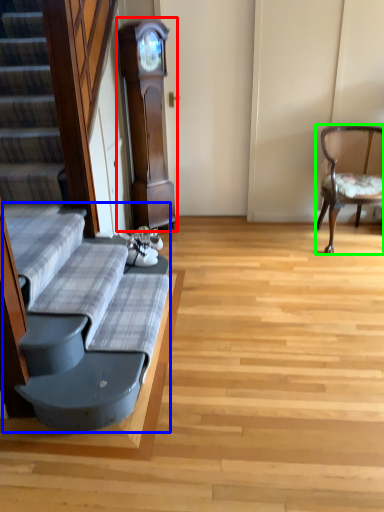
Question: Considering the real-world distances, which object is farthest from cabinetry (highlighted by a red box)? couch (highlighted by a blue box) or chair (highlighted by a green box)?

Choices:
 (A) couch
 (B) chair

Answer: (A)